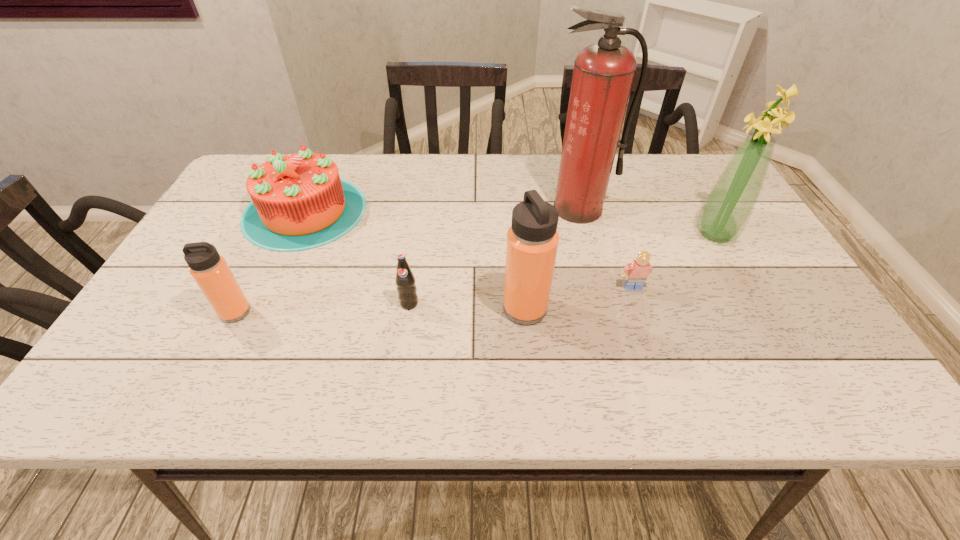
Given the evenly spaced thermos bottles in the image, where should an extra thermos bottle be added on the right to preserve the spacing? Please point to a vacant space. Please provide its 2D coordinates. Your answer should be formatted as a tuple, i.e. [(x, y)], where the tuple contains the x and y coordinates of a point satisfying the conditions above.

[(811, 306)]